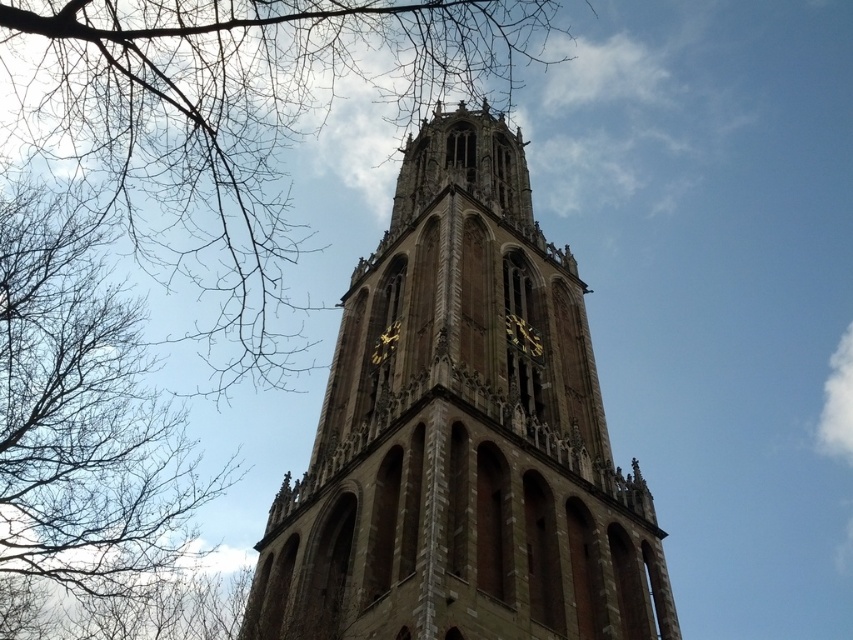
Does brown stone tower at center have a greater height compared to bare branches at upper left?

No, brown stone tower at center is not taller than bare branches at upper left.

Which is more to the right, brown stone tower at center or bare branches at upper left?

brown stone tower at center

Is point (329, 618) behind point (268, 148)?

That is False.

In order to click on brown stone tower at center in this screenshot , I will do `click(462, 435)`.

Is brown stone tower at center thinner than brown leafless branches at left?

In fact, brown stone tower at center might be wider than brown leafless branches at left.

How much distance is there between brown stone tower at center and brown leafless branches at left?

A distance of 138.93 feet exists between brown stone tower at center and brown leafless branches at left.

Between point (404, 150) and point (57, 614), which one is positioned in front?

Positioned in front is point (57, 614).

You are a GUI agent. You are given a task and a screenshot of the screen. Output one action in this format:
    pyautogui.click(x=<x>, y=<y>)
    Task: Click on the brown stone tower at center
    The image size is (853, 640).
    Given the screenshot: What is the action you would take?
    pyautogui.click(x=462, y=435)

Who is taller, bare branches at upper left or brown leafless branches at left?

bare branches at upper left is taller.

Which is more to the right, bare branches at upper left or brown leafless branches at left?

From the viewer's perspective, bare branches at upper left appears more on the right side.

Where is `bare branches at upper left`? The height and width of the screenshot is (640, 853). bare branches at upper left is located at coordinates (231, 116).

At what (x,y) coordinates should I click in order to perform the action: click on bare branches at upper left. Please return your answer as a coordinate pair (x, y). The height and width of the screenshot is (640, 853). Looking at the image, I should click on (231, 116).